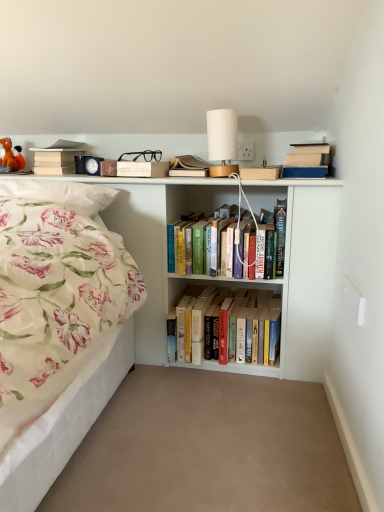
Question: From the image's perspective, is hardcover books at center, which is counted as the second book, starting from the left, above or below white matte table lamp at upper center?

Choices:
 (A) above
 (B) below

Answer: (B)

Question: In terms of size, does hardcover books at center, which ranks as the third book in top-to-bottom order, appear bigger or smaller than white matte table lamp at upper center?

Choices:
 (A) small
 (B) big

Answer: (B)

Question: Estimate the real-world distances between objects in this image. Which object is farther from the hardcover books at center, positioned as the 1th book in bottom-to-top order?

Choices:
 (A) matte brown book at upper center
 (B) white matte table lamp at upper center
 (C) beige matte book at upper left, which is counted as the 1th book, starting from the left
 (D) white matte bookcase at upper center
 (E) beige carpet at center

Answer: (C)

Question: Estimate the real-world distances between objects in this image. Which object is closer to the matte brown book at upper center?

Choices:
 (A) beige matte book at upper left, the 3th book from the bottom
 (B) white matte table lamp at upper center
 (C) orange plush toy at upper left
 (D) beige carpet at center
 (E) floral fabric pillow at left

Answer: (E)